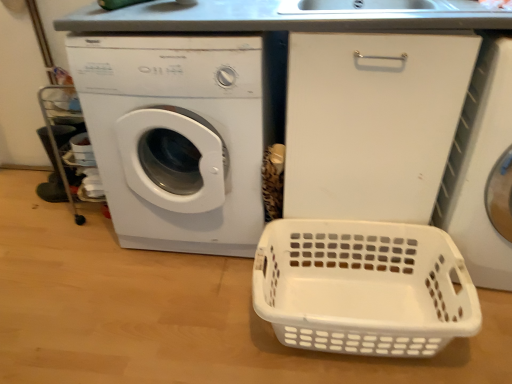
Question: Is white plastic washing machine at right, the 1th washing machine from the right, not near white plastic washing machine at left, the 1th washing machine from the left?

Choices:
 (A) no
 (B) yes

Answer: (A)

Question: Is white plastic washing machine at right, acting as the 2th washing machine starting from the left, wider than white plastic washing machine at left, the 1th washing machine from the left?

Choices:
 (A) no
 (B) yes

Answer: (B)

Question: Considering the relative sizes of white plastic washing machine at right, the 1th washing machine from the right, and white plastic washing machine at left, arranged as the second washing machine when viewed from the right, in the image provided, is white plastic washing machine at right, the 1th washing machine from the right, shorter than white plastic washing machine at left, arranged as the second washing machine when viewed from the right,?

Choices:
 (A) no
 (B) yes

Answer: (B)

Question: Is white plastic washing machine at right, the 1th washing machine from the right, taller than white plastic washing machine at left, arranged as the second washing machine when viewed from the right?

Choices:
 (A) yes
 (B) no

Answer: (B)

Question: From the image's perspective, is white plastic washing machine at right, the 1th washing machine from the right, under white plastic washing machine at left, arranged as the second washing machine when viewed from the right?

Choices:
 (A) yes
 (B) no

Answer: (A)

Question: Is white plastic basket at lower right in front of or behind white plastic washing machine at left, the 1th washing machine from the left, in the image?

Choices:
 (A) front
 (B) behind

Answer: (A)

Question: From their relative heights in the image, would you say white plastic basket at lower right is taller or shorter than white plastic washing machine at left, the 1th washing machine from the left?

Choices:
 (A) short
 (B) tall

Answer: (A)

Question: Is point [x=437, y=307] positioned closer to the camera than point [x=222, y=39]?

Choices:
 (A) closer
 (B) farther

Answer: (B)

Question: Is white plastic basket at lower right to the left or to the right of white plastic washing machine at left, arranged as the second washing machine when viewed from the right, in the image?

Choices:
 (A) right
 (B) left

Answer: (A)

Question: Would you say white plastic washing machine at right, acting as the 2th washing machine starting from the left, is to the left or to the right of white plastic washing machine at left, the 1th washing machine from the left, in the picture?

Choices:
 (A) right
 (B) left

Answer: (A)

Question: In terms of width, does white plastic washing machine at right, acting as the 2th washing machine starting from the left, look wider or thinner when compared to white plastic washing machine at left, the 1th washing machine from the left?

Choices:
 (A) thin
 (B) wide

Answer: (B)

Question: Considering the positions of white plastic washing machine at right, the 1th washing machine from the right, and white plastic washing machine at left, arranged as the second washing machine when viewed from the right, in the image, is white plastic washing machine at right, the 1th washing machine from the right, bigger or smaller than white plastic washing machine at left, arranged as the second washing machine when viewed from the right,?

Choices:
 (A) big
 (B) small

Answer: (B)

Question: From the image's perspective, relative to white plastic washing machine at left, the 1th washing machine from the left, is white plastic washing machine at right, the 1th washing machine from the right, above or below?

Choices:
 (A) above
 (B) below

Answer: (B)

Question: Is white plastic washing machine at left, arranged as the second washing machine when viewed from the right, taller or shorter than white plastic washing machine at right, the 1th washing machine from the right?

Choices:
 (A) tall
 (B) short

Answer: (A)

Question: Which is correct: white plastic washing machine at left, the 1th washing machine from the left, is inside white plastic washing machine at right, the 1th washing machine from the right, or outside of it?

Choices:
 (A) outside
 (B) inside

Answer: (A)